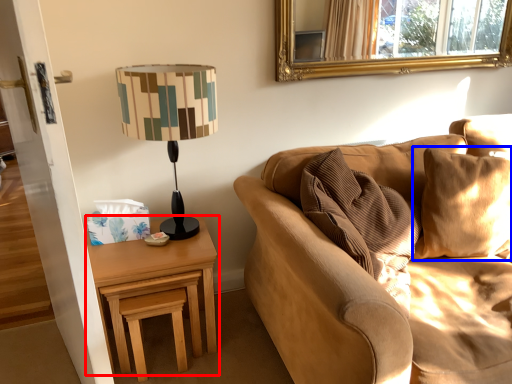
Question: Which object appears closest to the camera in this image, nightstand (highlighted by a red box) or pillow (highlighted by a blue box)?

Choices:
 (A) nightstand
 (B) pillow

Answer: (B)